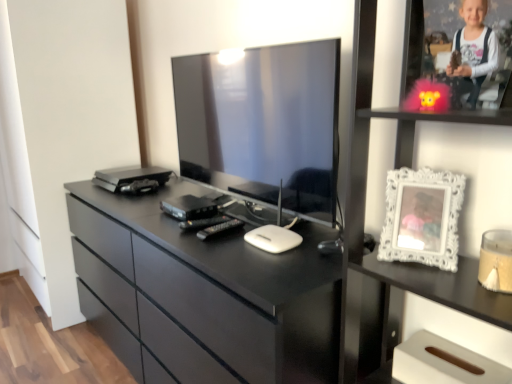
This screenshot has width=512, height=384. Identify the location of free space in front of satin black device at center. (173, 228).